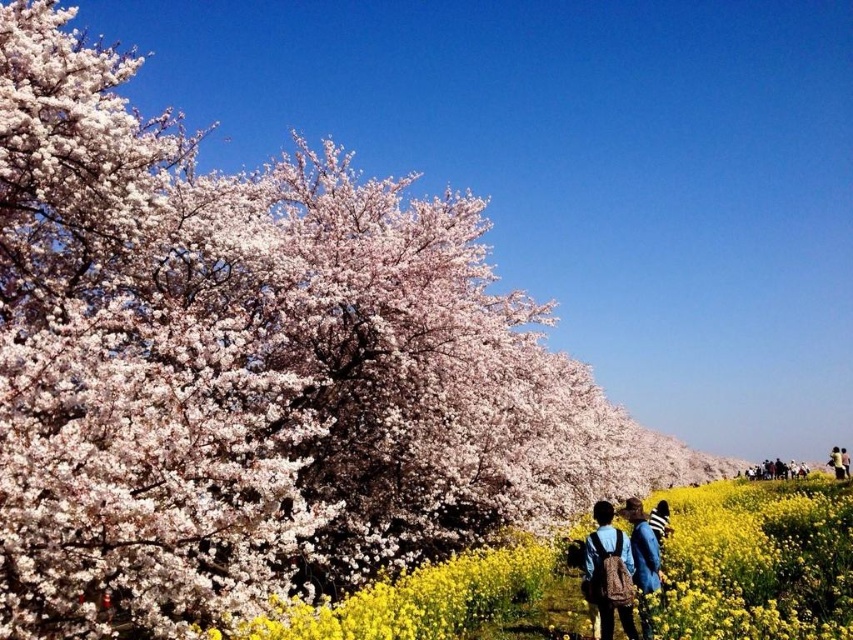
Which is more to the left, blue fabric jacket at lower right or blue denim jacket at lower right?

From the viewer's perspective, blue fabric jacket at lower right appears more on the left side.

Who is taller, blue fabric jacket at lower right or blue denim jacket at lower right?

Standing taller between the two is blue fabric jacket at lower right.

Find the location of a particular element. blue fabric jacket at lower right is located at coordinates (643, 560).

Between denim jacket at center and blue denim jacket at lower right, which one has more height?

blue denim jacket at lower right is taller.

Can you confirm if denim jacket at center is shorter than blue denim jacket at lower right?

Indeed, denim jacket at center has a lesser height compared to blue denim jacket at lower right.

Identify the location of denim jacket at center. (619, 563).

The width and height of the screenshot is (853, 640). Find the location of `denim jacket at center`. denim jacket at center is located at coordinates (619, 563).

Between white fluffy blossoms at center and denim jacket at center, which one appears on the left side from the viewer's perspective?

denim jacket at center is more to the left.

What do you see at coordinates (758, 561) in the screenshot? I see `white fluffy blossoms at center` at bounding box center [758, 561].

Is point (503, 611) farther from viewer compared to point (599, 508)?

Yes, point (503, 611) is farther from viewer.

The image size is (853, 640). What are the coordinates of `white fluffy blossoms at center` in the screenshot? It's located at (758, 561).